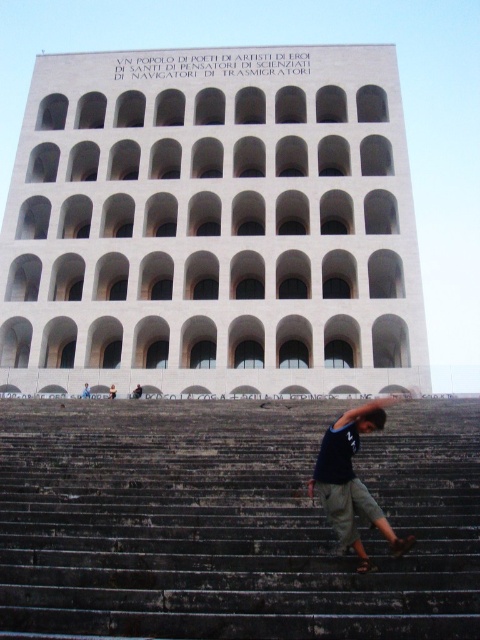
Question: Does dark gray concrete stairs at center lie in front of dark blue t-shirt at center?

Choices:
 (A) yes
 (B) no

Answer: (A)

Question: Which object is farther from the camera taking this photo?

Choices:
 (A) dark blue shirt at lower center
 (B) dark blue t-shirt at center
 (C) dark gray concrete stairs at center

Answer: (A)

Question: Observing the image, what is the correct spatial positioning of dark gray concrete stairs at center in reference to dark blue shirt at lower center?

Choices:
 (A) above
 (B) below

Answer: (B)

Question: Is dark blue t-shirt at center thinner than dark blue shirt at lower center?

Choices:
 (A) no
 (B) yes

Answer: (A)

Question: Which object is positioned farthest from the dark blue shirt at lower center?

Choices:
 (A) dark blue t-shirt at center
 (B) dark gray concrete stairs at center

Answer: (B)

Question: Which object is the closest to the dark blue shirt at lower center?

Choices:
 (A) dark gray concrete stairs at center
 (B) dark blue t-shirt at center

Answer: (B)